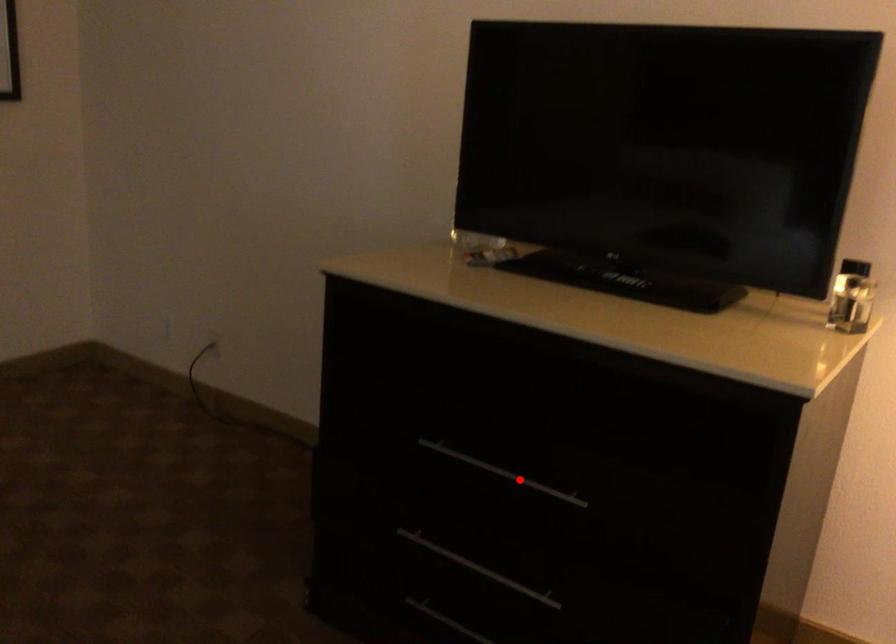
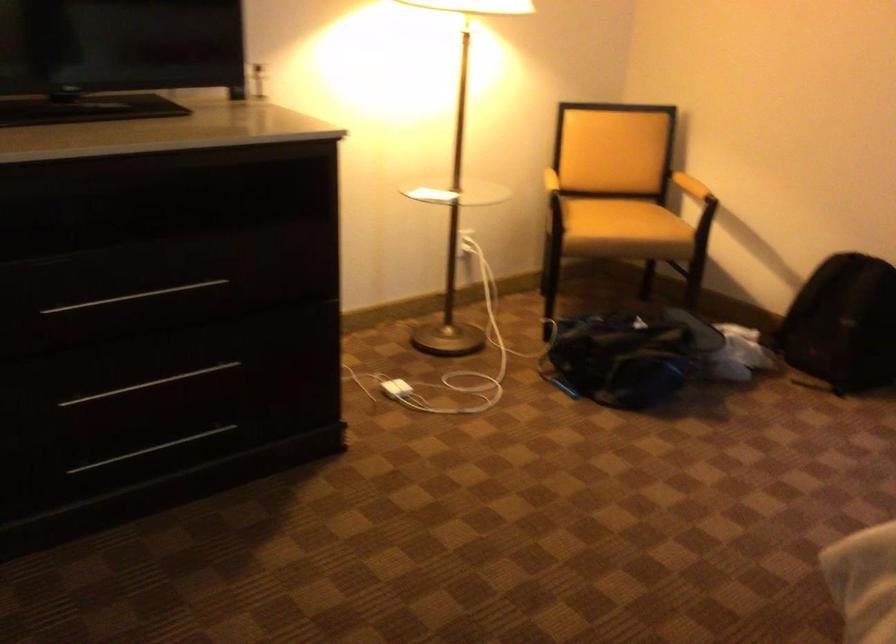
Question: I am providing you with two images of the same scene from different viewpoints. A red point is shown in image1. For the corresponding object point in image2, is it positioned nearer or farther from the camera?

Choices:
 (A) Nearer
 (B) Farther

Answer: (B)